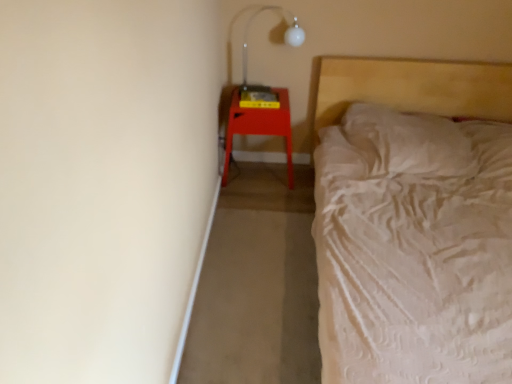
What do you see at coordinates (248, 33) in the screenshot? I see `transparent plastic lamp at upper right` at bounding box center [248, 33].

The image size is (512, 384). What are the coordinates of `matte red stool at right` in the screenshot? It's located at (259, 127).

I want to click on transparent plastic lamp at upper right, so 248,33.

From a real-world perspective, which object stands above the other?

white textured bed at right, from a real-world perspective.

From the image's perspective, which one is positioned higher, matte red stool at right or white textured bed at right?

matte red stool at right.

From the picture: Which of these two, matte red stool at right or white textured bed at right, is wider?

white textured bed at right is wider.

Which is behind, matte red stool at right or white textured bed at right?

matte red stool at right.

Considering the relative sizes of matte red stool at right and transparent plastic lamp at upper right in the image provided, is matte red stool at right bigger than transparent plastic lamp at upper right?

Yes, matte red stool at right is bigger than transparent plastic lamp at upper right.

Measure the distance from matte red stool at right to transparent plastic lamp at upper right.

matte red stool at right is 14.23 inches away from transparent plastic lamp at upper right.

Does matte red stool at right turn towards transparent plastic lamp at upper right?

No, matte red stool at right is not facing towards transparent plastic lamp at upper right.

Is matte red stool at right next to transparent plastic lamp at upper right and touching it?

No, matte red stool at right is not in contact with transparent plastic lamp at upper right.

Between white textured bed at right and transparent plastic lamp at upper right, which one has smaller width?

Thinner between the two is transparent plastic lamp at upper right.

Is white textured bed at right oriented towards transparent plastic lamp at upper right?

No, white textured bed at right is not oriented towards transparent plastic lamp at upper right.

Is white textured bed at right taller or shorter than transparent plastic lamp at upper right?

Considering their sizes, white textured bed at right has more height than transparent plastic lamp at upper right.

Is white textured bed at right touching matte red stool at right?

white textured bed at right and matte red stool at right are clearly separated.

Could matte red stool at right be considered to be inside white textured bed at right?

No, matte red stool at right is not a part of white textured bed at right.

Which object is positioned more to the right, white textured bed at right or matte red stool at right?

Positioned to the right is white textured bed at right.

Is transparent plastic lamp at upper right turned away from white textured bed at right?

No, transparent plastic lamp at upper right is not facing the opposite direction of white textured bed at right.

From the image's perspective, is transparent plastic lamp at upper right positioned above or below white textured bed at right?

Clearly, from the image's perspective, transparent plastic lamp at upper right is above white textured bed at right.

Is transparent plastic lamp at upper right bigger than white textured bed at right?

No, transparent plastic lamp at upper right is not bigger than white textured bed at right.

Consider the image. From a real-world perspective, which is physically above, transparent plastic lamp at upper right or matte red stool at right?

transparent plastic lamp at upper right.

Considering the sizes of objects transparent plastic lamp at upper right and matte red stool at right in the image provided, who is taller, transparent plastic lamp at upper right or matte red stool at right?

With more height is matte red stool at right.

Identify the location of furniture lying below the transparent plastic lamp at upper right (from the image's perspective). (259, 127).

Image resolution: width=512 pixels, height=384 pixels. Find the location of `bed that is on the right side of matte red stool at right`. bed that is on the right side of matte red stool at right is located at coordinates (413, 87).

You are a GUI agent. You are given a task and a screenshot of the screen. Output one action in this format:
    pyautogui.click(x=<x>, y=<y>)
    Task: Click on the furniture on the left of the transparent plastic lamp at upper right
    
    Given the screenshot: What is the action you would take?
    pyautogui.click(x=259, y=127)

Estimate the real-world distances between objects in this image. Which object is further from transparent plastic lamp at upper right, white textured bed at right or matte red stool at right?

white textured bed at right is positioned further to the anchor transparent plastic lamp at upper right.

Which object lies nearer to the anchor point matte red stool at right, white textured bed at right or transparent plastic lamp at upper right?

transparent plastic lamp at upper right is closer to matte red stool at right.

Which object lies further to the anchor point transparent plastic lamp at upper right, matte red stool at right or white textured bed at right?

white textured bed at right.

Estimate the real-world distances between objects in this image. Which object is closer to white textured bed at right, matte red stool at right or transparent plastic lamp at upper right?

matte red stool at right lies closer to white textured bed at right than the other object.

From the image, which object appears to be nearer to white textured bed at right, transparent plastic lamp at upper right or matte red stool at right?

Among the two, matte red stool at right is located nearer to white textured bed at right.

Looking at the image, which one is located further to matte red stool at right, transparent plastic lamp at upper right or white textured bed at right?

white textured bed at right is further to matte red stool at right.

Identify the location of lamp between white textured bed at right and matte red stool at right from front to back. The height and width of the screenshot is (384, 512). (248, 33).